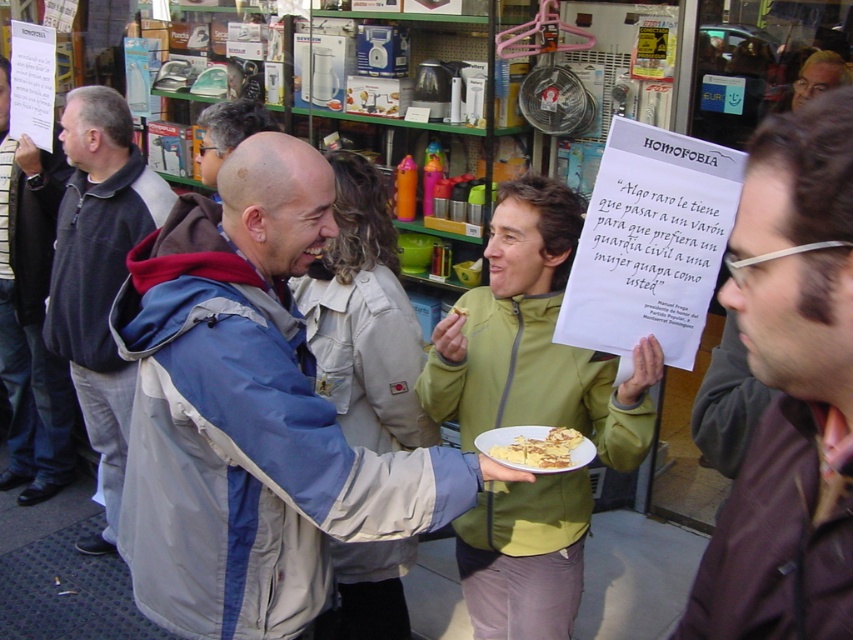
Question: Can you confirm if light gray jacket at center is thinner than brown leather jacket at center?

Choices:
 (A) no
 (B) yes

Answer: (A)

Question: Which point appears closest to the camera in this image?

Choices:
 (A) (804, 99)
 (B) (521, 467)
 (C) (7, 308)
 (D) (809, 312)

Answer: (D)

Question: Which point is farther to the camera?

Choices:
 (A) (740, 216)
 (B) (582, 445)
 (C) (77, 269)

Answer: (C)

Question: Observing the image, what is the correct spatial positioning of light gray jacket at center in reference to smooth brown hair at upper right?

Choices:
 (A) above
 (B) below

Answer: (B)

Question: Estimate the real-world distances between objects in this image. Which object is farther from the light gray jacket at center?

Choices:
 (A) smooth brown hair at upper right
 (B) dark blue jacket at center
 (C) brown leather jacket at center

Answer: (A)

Question: Does golden crumbly cake at center appear over smooth brown hair at upper right?

Choices:
 (A) yes
 (B) no

Answer: (B)